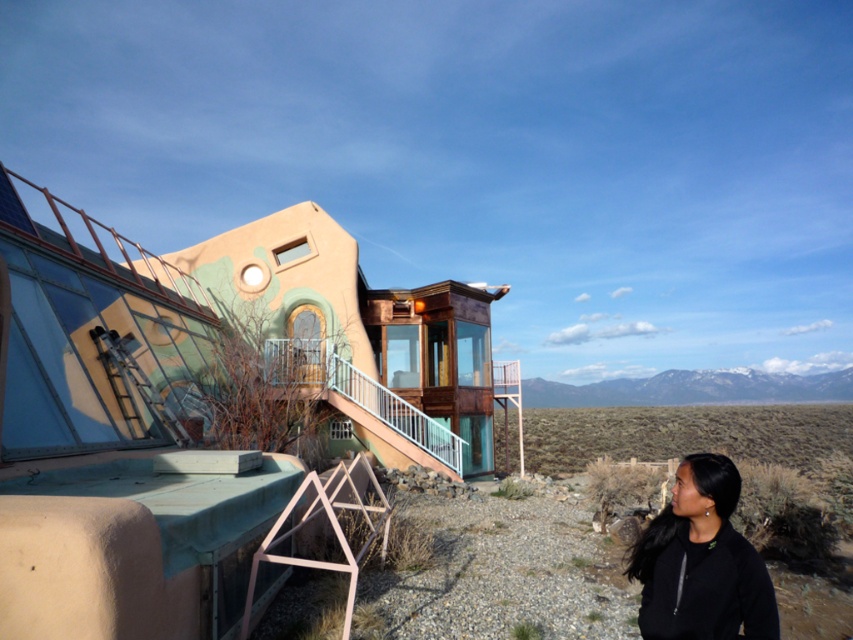
Question: Which point is closer to the camera taking this photo?

Choices:
 (A) (709, 408)
 (B) (679, 538)

Answer: (B)

Question: Among these points, which one is farthest from the camera?

Choices:
 (A) 303,628
 (B) 750,568

Answer: (A)

Question: Where is desert gravel at lower center located in relation to black matte jacket at lower right in the image?

Choices:
 (A) below
 (B) above

Answer: (A)

Question: Can you confirm if desert gravel at lower center is positioned to the right of black matte jacket at lower right?

Choices:
 (A) yes
 (B) no

Answer: (A)

Question: Can you confirm if desert gravel at lower center is positioned above black matte jacket at lower right?

Choices:
 (A) no
 (B) yes

Answer: (A)